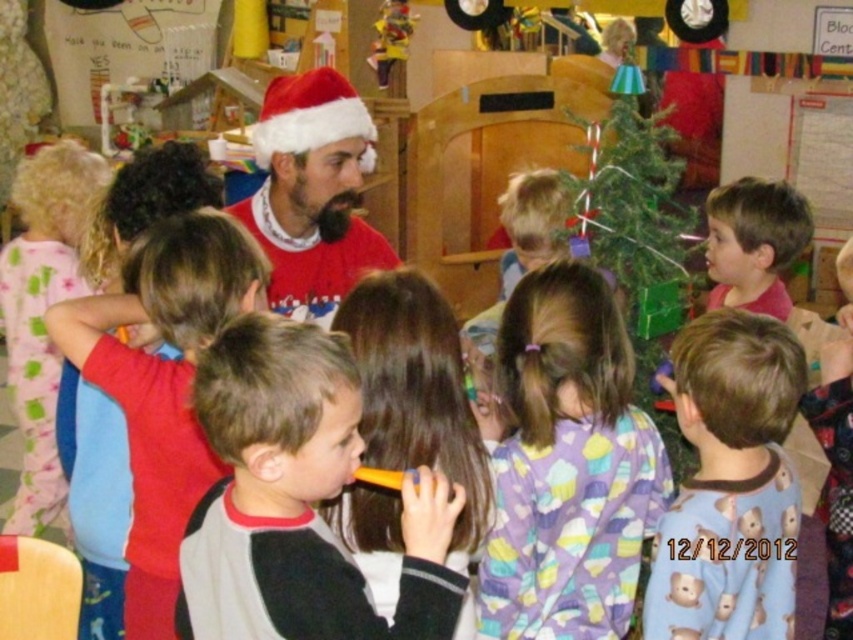
From the picture: Does white cotton shirt at center have a greater height compared to blonde hair at upper right?

Yes.

Who is more distant from viewer, (161,444) or (717,280)?

Positioned behind is point (717,280).

Is point (227, 292) farther from viewer compared to point (747, 289)?

No, it is not.

Locate an element on the screen. The width and height of the screenshot is (853, 640). white cotton shirt at center is located at coordinates (164, 385).

Which is above, fuzzy red sweater at center or pink fleece pajamas at left?

fuzzy red sweater at center is above.

Is fuzzy red sweater at center behind pink fleece pajamas at left?

No, fuzzy red sweater at center is in front of pink fleece pajamas at left.

What do you see at coordinates (312, 193) in the screenshot? The image size is (853, 640). I see `fuzzy red sweater at center` at bounding box center [312, 193].

Find the location of a particular element. The image size is (853, 640). fuzzy red sweater at center is located at coordinates (312, 193).

Is white cotton shirt at center thinner than orange plastic toothbrush at center?

No.

Does white cotton shirt at center have a larger size compared to orange plastic toothbrush at center?

Correct, white cotton shirt at center is larger in size than orange plastic toothbrush at center.

Locate an element on the screen. Image resolution: width=853 pixels, height=640 pixels. white cotton shirt at center is located at coordinates (164, 385).

You are a GUI agent. You are given a task and a screenshot of the screen. Output one action in this format:
    pyautogui.click(x=<x>, y=<y>)
    Task: Click on the white cotton shirt at center
    Image resolution: width=853 pixels, height=640 pixels.
    Given the screenshot: What is the action you would take?
    pyautogui.click(x=164, y=385)